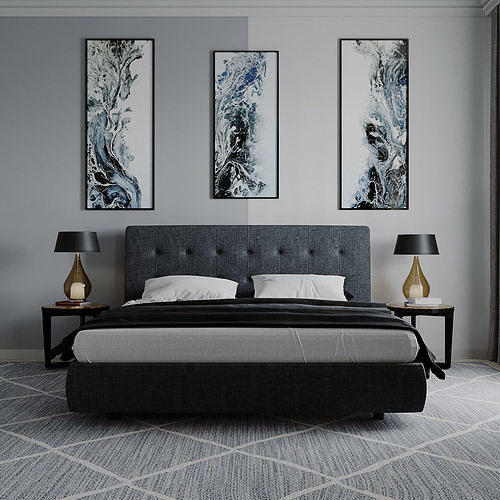
This screenshot has height=500, width=500. In order to click on lampshade in this screenshot , I will do `click(82, 245)`, `click(414, 246)`.